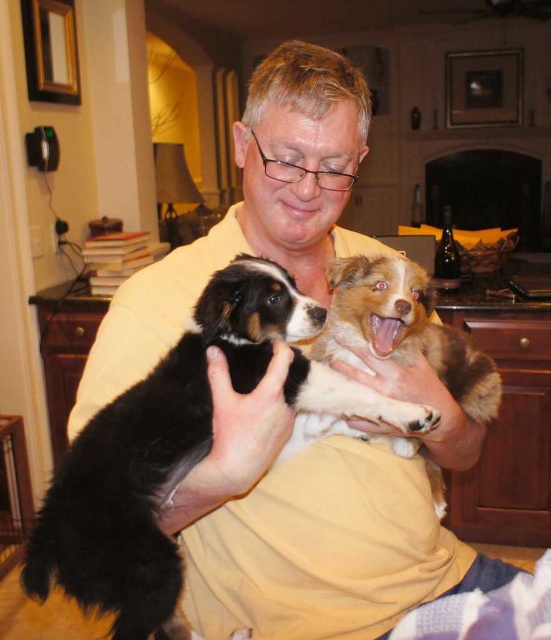
Looking at this image, you are a photographer trying to focus on two specific points in the image. The first point is at coordinates point (361, 388) and the second is at point (363, 330). Which point should you focus on first if you want to ensure the closest object is in focus?

Point (361, 388) is closer to the camera than point (363, 330), so you should focus on point (361, 388) first to ensure the closest object is in focus.